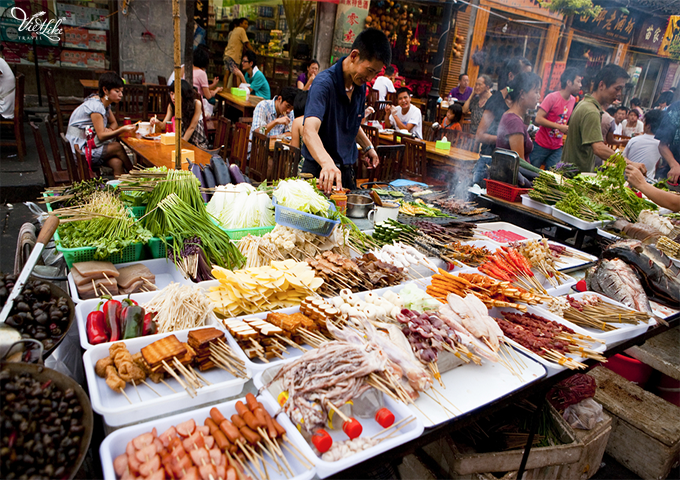
You are a GUI agent. You are given a task and a screenshot of the screen. Output one action in this format:
    pyautogui.click(x=<x>, y=<y>)
    Task: Click on the white platter with black border
    This screenshot has height=480, width=680.
    Given the screenshot: What is the action you would take?
    pyautogui.click(x=493, y=379)